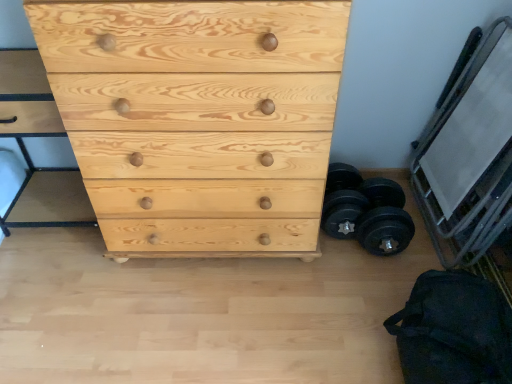
Locate an element on the screen. The image size is (512, 384). vacant space that is in between natural wood chest of drawers at center and black fabric bag at lower right is located at coordinates (288, 299).